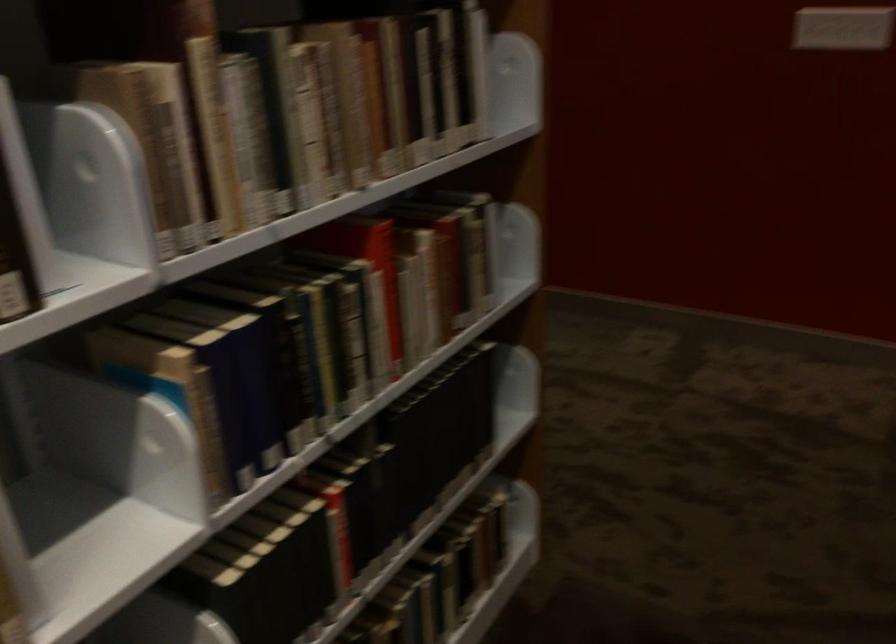
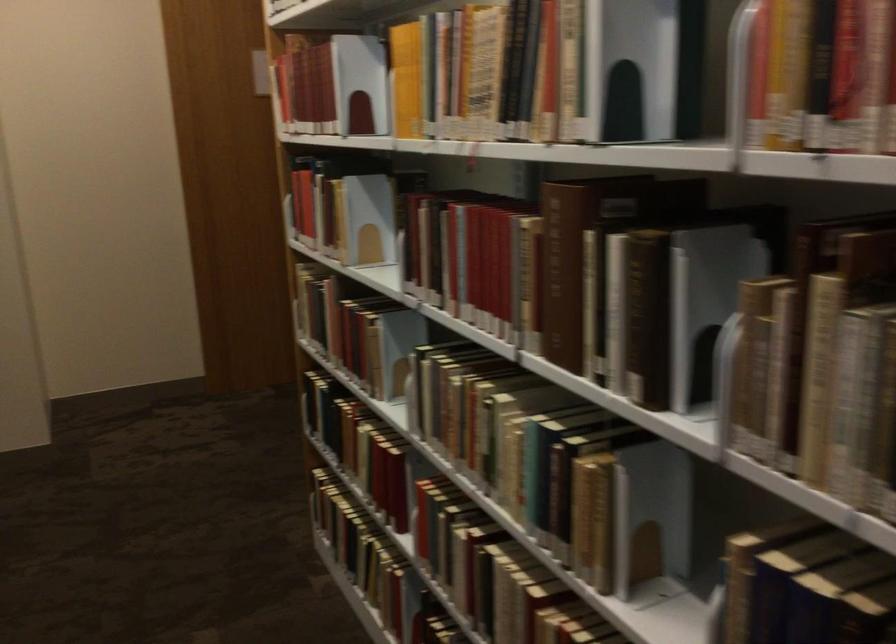
Where in the second image is the point corresponding to point 277,216 from the first image?

(879, 520)